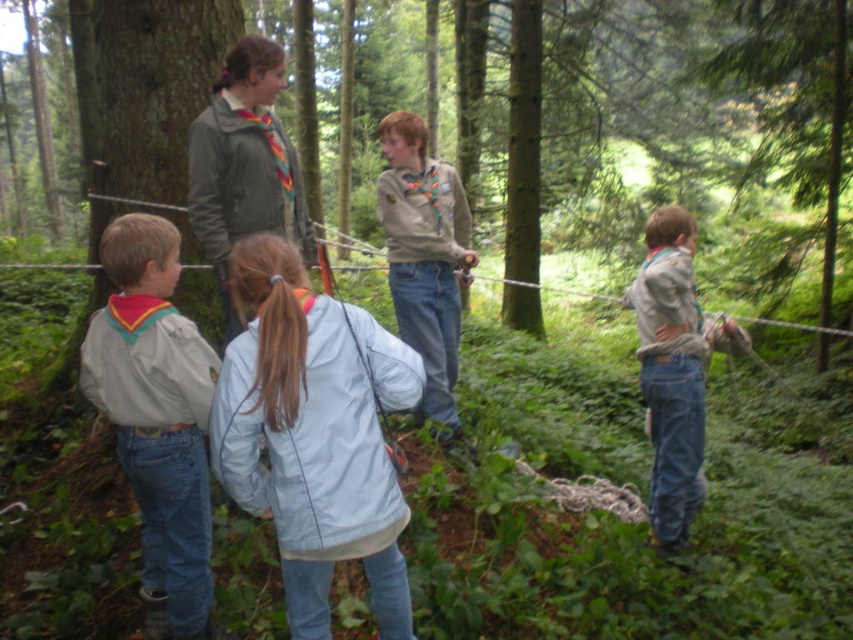
Question: Which of these objects is positioned closest to the light gray fleece jacket at left?

Choices:
 (A) light brown uniform at center
 (B) light blue fabric jacket at center
 (C) smooth bark tree at left
 (D) green matte tree at right

Answer: (B)

Question: Can you confirm if green matte tree at right is positioned to the right of light brown uniform at center?

Choices:
 (A) no
 (B) yes

Answer: (B)

Question: Which object appears farthest from the camera in this image?

Choices:
 (A) light blue fabric jacket at center
 (B) light brown uniform at center
 (C) smooth bark tree at left

Answer: (C)

Question: Where is smooth bark tree at left located in relation to light brown uniform at center in the image?

Choices:
 (A) right
 (B) left

Answer: (B)

Question: Which point is farther to the camera?

Choices:
 (A) smooth bark tree at left
 (B) light blue fabric jacket at center
 (C) light brown uniform at center
 (D) denim overalls at right

Answer: (A)

Question: Does light blue fabric jacket at center appear on the left side of green matte tree at right?

Choices:
 (A) yes
 (B) no

Answer: (A)